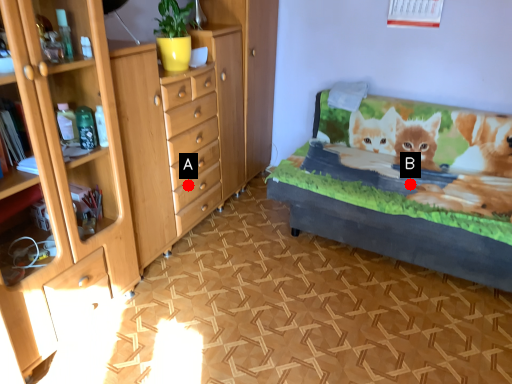
Question: Two points are circled on the image, labeled by A and B beside each circle. Which point is farther to the camera?

Choices:
 (A) A is further
 (B) B is further

Answer: (A)